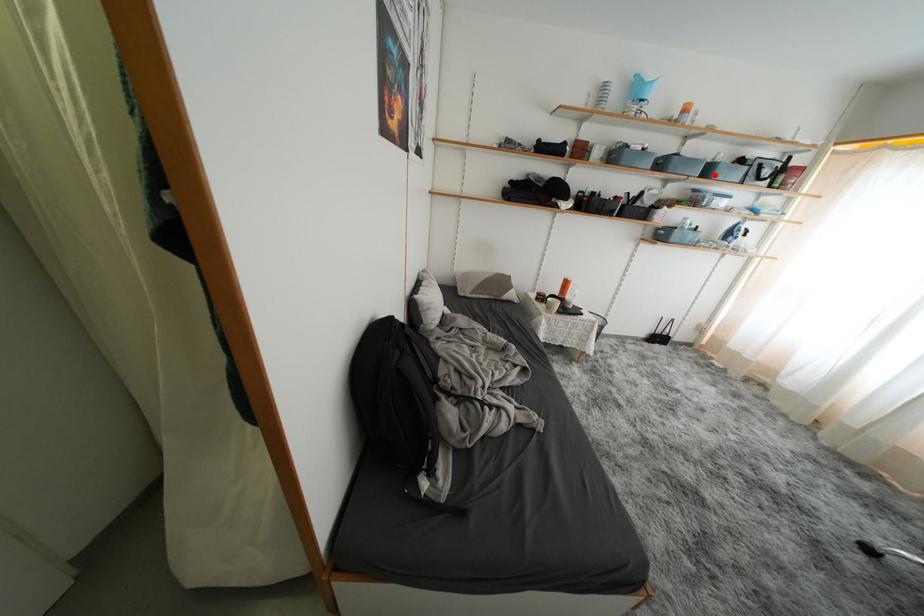
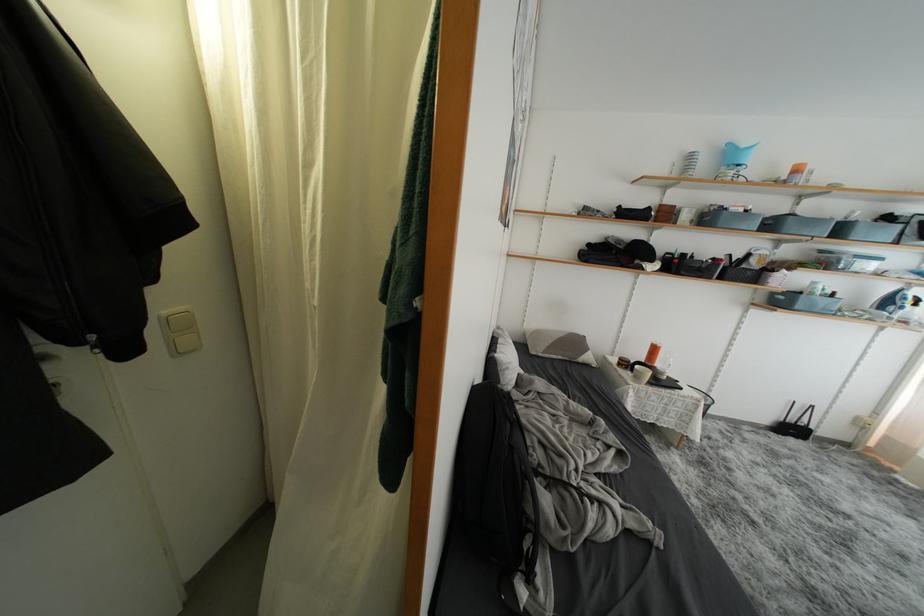
Question: I am providing you with two images of the same scene from different viewpoints. Image1 has a red point marked. In image2, the corresponding 3D location appears at what relative position? Reply with the corresponding letter.

Choices:
 (A) Closer
 (B) Farther

Answer: (B)